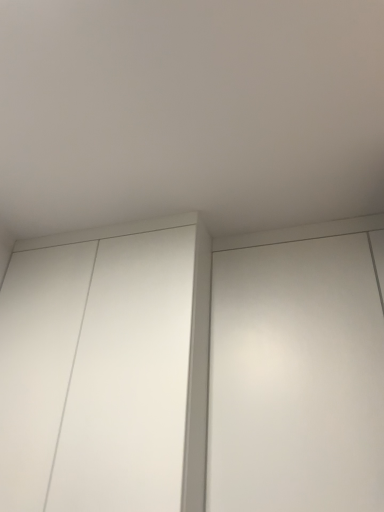
Question: Would you say white matte elevator at right is outside white matte cupboard at center?

Choices:
 (A) no
 (B) yes

Answer: (B)

Question: Can you confirm if white matte elevator at right is wider than white matte cupboard at center?

Choices:
 (A) no
 (B) yes

Answer: (A)

Question: Is white matte elevator at right positioned far away from white matte cupboard at center?

Choices:
 (A) no
 (B) yes

Answer: (A)

Question: Is white matte elevator at right positioned before white matte cupboard at center?

Choices:
 (A) no
 (B) yes

Answer: (B)

Question: Can you confirm if white matte elevator at right is positioned to the left of white matte cupboard at center?

Choices:
 (A) yes
 (B) no

Answer: (B)

Question: Does white matte elevator at right appear on the right side of white matte cupboard at center?

Choices:
 (A) no
 (B) yes

Answer: (B)

Question: Is white matte cupboard at center placed right next to white matte elevator at right?

Choices:
 (A) no
 (B) yes

Answer: (A)

Question: Is white matte cupboard at center facing away from white matte elevator at right?

Choices:
 (A) yes
 (B) no

Answer: (B)

Question: Can you confirm if white matte cupboard at center is wider than white matte elevator at right?

Choices:
 (A) yes
 (B) no

Answer: (A)

Question: Is white matte cupboard at center bigger than white matte elevator at right?

Choices:
 (A) yes
 (B) no

Answer: (A)

Question: Could you tell me if white matte cupboard at center is facing white matte elevator at right?

Choices:
 (A) no
 (B) yes

Answer: (A)

Question: Can you confirm if white matte cupboard at center is positioned to the left of white matte elevator at right?

Choices:
 (A) yes
 (B) no

Answer: (A)

Question: Is point (23, 388) positioned closer to the camera than point (332, 274)?

Choices:
 (A) closer
 (B) farther

Answer: (A)